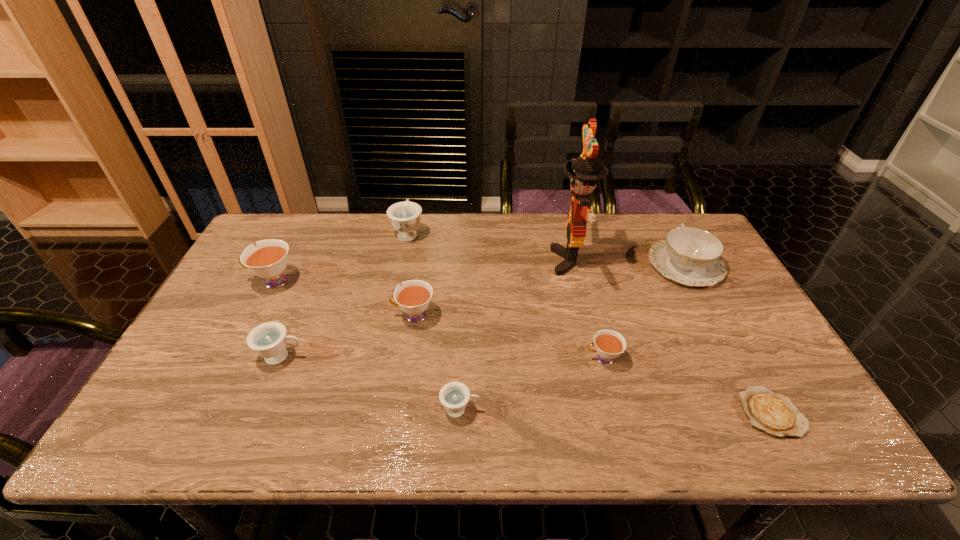
I want to click on unoccupied area between the fifth object from left to right and the chinaware, so click(573, 338).

At what (x,y) coordinates should I click in order to perform the action: click on free area in between the blue chinaware and the biggest blue teacup. Please return your answer as a coordinate pair (x, y). This screenshot has height=540, width=960. Looking at the image, I should click on (547, 249).

You are a GUI agent. You are given a task and a screenshot of the screen. Output one action in this format:
    pyautogui.click(x=<x>, y=<y>)
    Task: Click on the free space that is in between the second biggest blue teacup and the smallest blue teacup
    The height and width of the screenshot is (540, 960).
    Given the screenshot: What is the action you would take?
    pyautogui.click(x=372, y=383)

Find the location of a particular element. empty space that is in between the brown quiche and the farthest white teacup is located at coordinates (522, 347).

Locate an element on the screen. This screenshot has height=540, width=960. free spot between the rightmost teacup and the nutcracker is located at coordinates 587,310.

This screenshot has width=960, height=540. Find the location of `the eighth closest object relative to the quiche`. the eighth closest object relative to the quiche is located at coordinates (269, 259).

At what (x,y) coordinates should I click in order to perform the action: click on object that stands as the sixth closest to the fifth nearest object. Please return your answer as a coordinate pair (x, y). The image size is (960, 540). Looking at the image, I should click on (609, 344).

Identify which teacup is located as the fourth nearest to the biggest white teacup. Please provide its 2D coordinates. Your answer should be formatted as a tuple, i.e. [(x, y)], where the tuple contains the x and y coordinates of a point satisfying the conditions above.

[(454, 396)]

At what (x,y) coordinates should I click in order to perform the action: click on teacup object that ranks as the second closest to the nutcracker. Please return your answer as a coordinate pair (x, y). Image resolution: width=960 pixels, height=540 pixels. Looking at the image, I should click on (414, 296).

Locate which white teacup ranks in proximity to the chinaware. Please provide its 2D coordinates. Your answer should be formatted as a tuple, i.e. [(x, y)], where the tuple contains the x and y coordinates of a point satisfying the conditions above.

[(609, 344)]